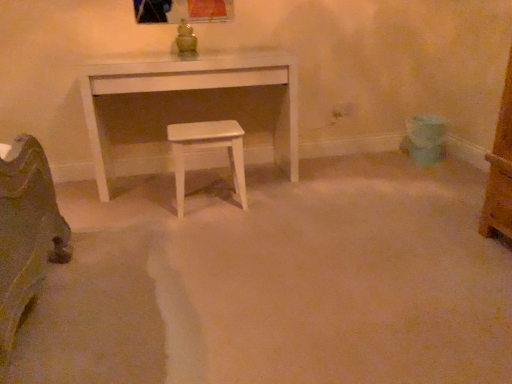
Question: From a real-world perspective, is white glossy stool at center positioned above or below white matte table at center?

Choices:
 (A) above
 (B) below

Answer: (B)

Question: Is white glossy stool at center bigger or smaller than white matte table at center?

Choices:
 (A) small
 (B) big

Answer: (A)

Question: Is white glossy stool at center to the left or to the right of white matte table at center in the image?

Choices:
 (A) right
 (B) left

Answer: (A)

Question: Is white matte table at center situated inside white glossy stool at center or outside?

Choices:
 (A) inside
 (B) outside

Answer: (B)

Question: Is white matte table at center wider or thinner than white glossy stool at center?

Choices:
 (A) wide
 (B) thin

Answer: (A)

Question: From a real-world perspective, relative to white glossy stool at center, is white matte table at center vertically above or below?

Choices:
 (A) above
 (B) below

Answer: (A)

Question: Is point (141, 64) positioned closer to the camera than point (178, 213)?

Choices:
 (A) closer
 (B) farther

Answer: (B)